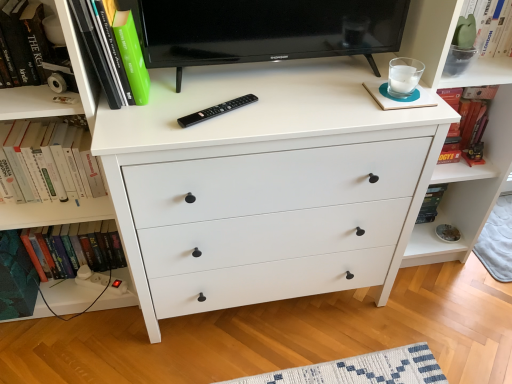
Identify the location of empty space that is to the right of green matte book at upper left, which appears as the third book when ordered from the bottom. The height and width of the screenshot is (384, 512). (187, 103).